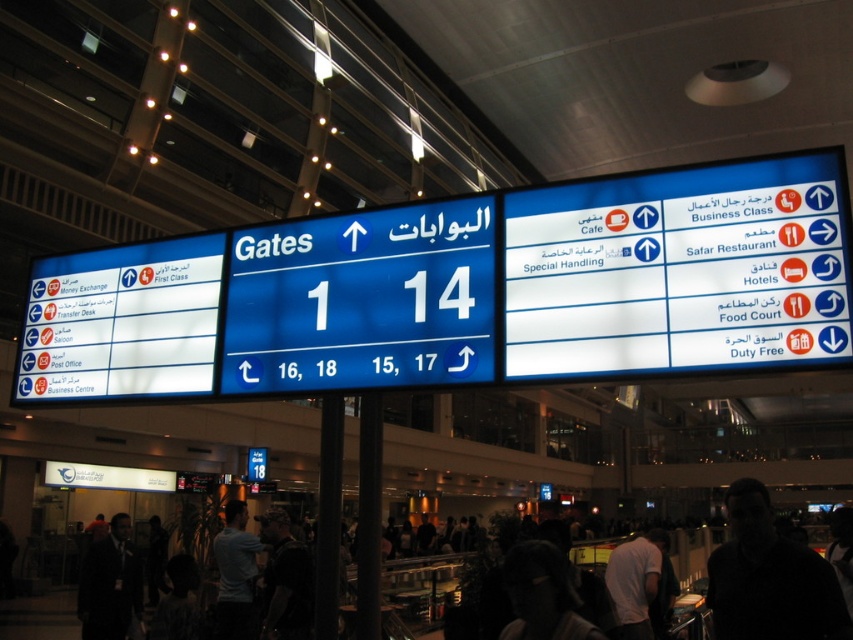
Question: Can you confirm if dark suit at lower left is smaller than white t-shirt at center?

Choices:
 (A) yes
 (B) no

Answer: (B)

Question: Which object is closer to the camera taking this photo?

Choices:
 (A) blue glossy sign at center
 (B) dark suit at lower left

Answer: (A)

Question: Which object is farther from the camera taking this photo?

Choices:
 (A) dark skin face at center
 (B) dark fabric person at center
 (C) blue glossy signboard at center

Answer: (B)

Question: Which point is closer to the camera?

Choices:
 (A) blue glossy sign at center
 (B) dark fabric person at center

Answer: (A)

Question: Is dark skin face at center to the left of white t-shirt at center from the viewer's perspective?

Choices:
 (A) yes
 (B) no

Answer: (B)

Question: Is dark skin face at center in front of dark suit at lower left?

Choices:
 (A) no
 (B) yes

Answer: (B)